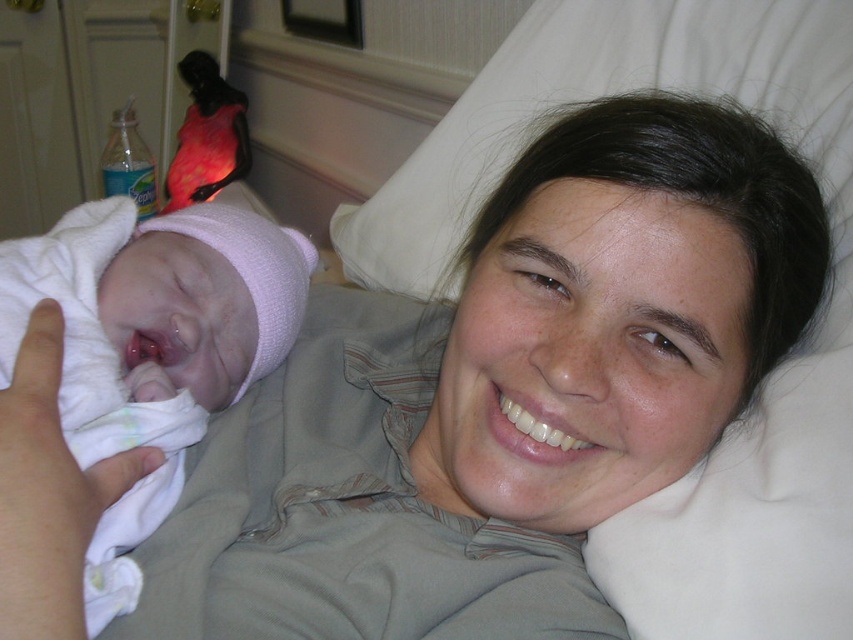
You are a nurse in the hospital room. You need to choose between the white soft cloth at left and the shiny pink parrot at upper left to clean a small spill. Which object is more suitable for this task?

The white soft cloth at left is more suitable for cleaning the spill because it is thinner and can absorb liquid better than the shiny pink parrot at upper left.

In the hospital scene, there is a white soft cloth at left and a shiny pink parrot at upper left. Which object is larger?

The shiny pink parrot at upper left is larger than the white soft cloth at left.